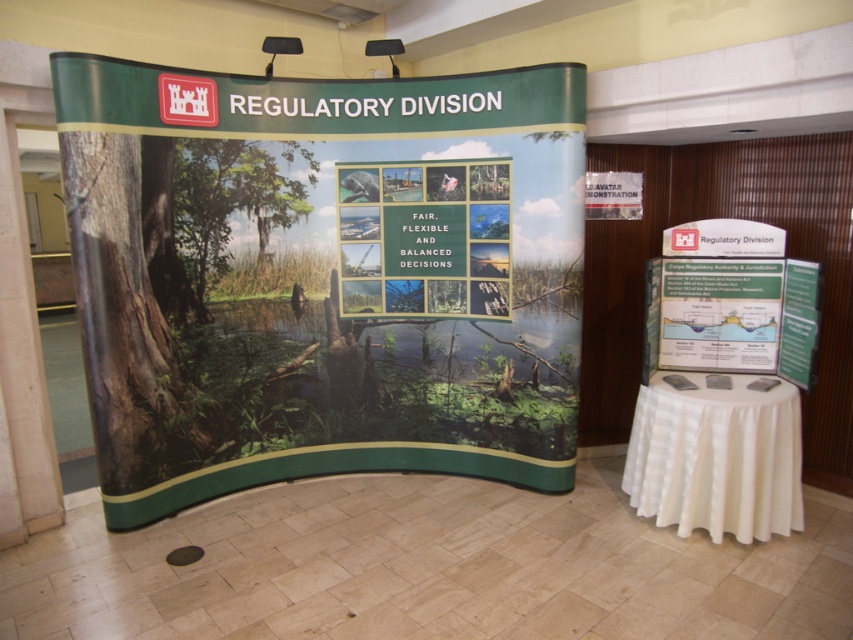
From the picture: You are standing in front of the Regulatory Division display and notice two points marked on the banner. Which point is closer to you, point 1 at coordinates (187,378) or point 2 at coordinates (744,458)?

Point 1 at coordinates (187,378) is closer to you because it is further to the viewer than point 2 at coordinates (744,458).

You are an event planner standing at the entrance of the exhibition hall. You notice a point marked at coordinates [322,275] on your map. What does this point indicate?

The point marked at coordinates [322,275] indicates the location of the matte green poster at center.